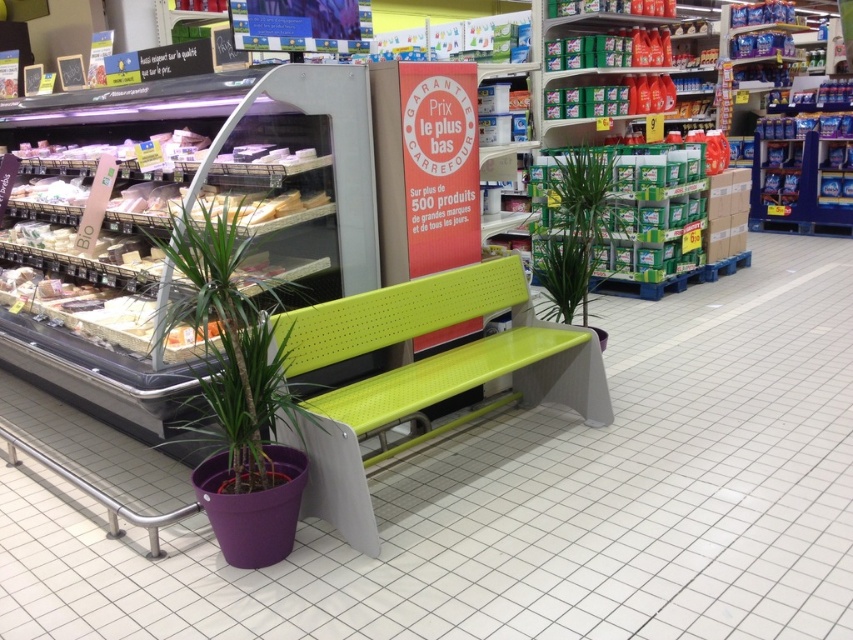
Who is more distant from viewer, (579,444) or (183,221)?

Point (579,444)

Which is in front, point (59, 412) or point (184, 280)?

Point (184, 280) is more forward.

This screenshot has width=853, height=640. In order to click on green plastic bench at center in this screenshot , I will do `click(537, 502)`.

Is point (755, 490) farther from viewer compared to point (572, 208)?

No, it is in front of (572, 208).

The height and width of the screenshot is (640, 853). What do you see at coordinates (537, 502) in the screenshot?
I see `green plastic bench at center` at bounding box center [537, 502].

Who is more distant from viewer, [424,497] or [608,161]?

Point [608,161]

Locate an element on the screen. This screenshot has width=853, height=640. green plastic bench at center is located at coordinates (537, 502).

Does purple plastic pot at lower left lie in front of green leafy plant at center?

Yes, it is in front of green leafy plant at center.

What do you see at coordinates (228, 339) in the screenshot? I see `purple plastic pot at lower left` at bounding box center [228, 339].

Where is `purple plastic pot at lower left`? The width and height of the screenshot is (853, 640). purple plastic pot at lower left is located at coordinates (228, 339).